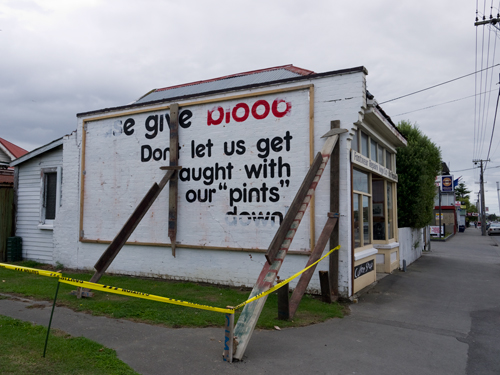
Where is `wires`? Image resolution: width=500 pixels, height=375 pixels. wires is located at coordinates (488, 108), (468, 72), (474, 119), (467, 96).